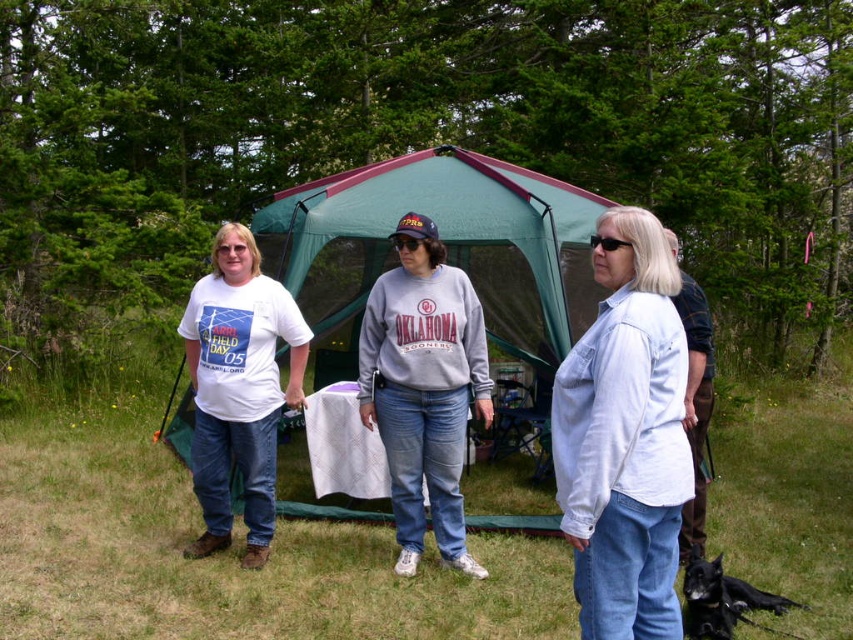
You are planning to set up a picnic and need to know the arrangement of items in the image. Are the green fabric tent at center and the black plastic sunglasses at center positioned such that the tent is on the left side of the sunglasses?

Yes, the green fabric tent at center is to the left of the black plastic sunglasses at center according to the description.

You are standing at the point marked as point (448, 273) and want to take a photo of the three women in the foreground. Since you need to be at least 4 meters away to capture them all in frame, will you be able to do so?

The distance of point (448, 273) from viewer is 4.54 meters, so yes, you can take the photo because you are more than 4 meters away from the three women in the foreground.